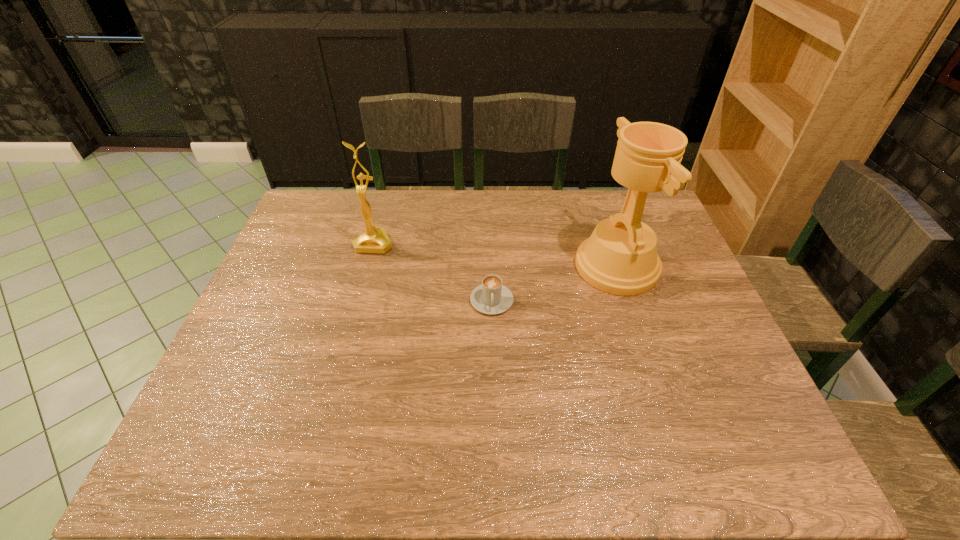
Find the location of `the rightmost object`. the rightmost object is located at coordinates (620, 257).

Identify the location of the tallest object. The height and width of the screenshot is (540, 960). (620, 257).

Find the location of a particular element. The width and height of the screenshot is (960, 540). the left award is located at coordinates (374, 239).

Locate an element on the screen. This screenshot has width=960, height=540. the second tallest object is located at coordinates (374, 239).

Locate an element on the screen. The width and height of the screenshot is (960, 540). cappuccino is located at coordinates (491, 297).

Locate an element on the screen. the second object from right to left is located at coordinates coord(491,297).

The height and width of the screenshot is (540, 960). What are the coordinates of `vacant space situated on the front of the rightmost object` in the screenshot? It's located at (671, 433).

You are a GUI agent. You are given a task and a screenshot of the screen. Output one action in this format:
    pyautogui.click(x=<x>, y=<y>)
    Task: Click on the vacant space located on the front-facing side of the left award
    This screenshot has height=540, width=960.
    Given the screenshot: What is the action you would take?
    pyautogui.click(x=353, y=320)

This screenshot has width=960, height=540. Find the location of `blank space located 0.090m to the right of the cappuccino`. blank space located 0.090m to the right of the cappuccino is located at coordinates (492, 345).

Where is `object positioned at the far edge`? This screenshot has height=540, width=960. object positioned at the far edge is located at coordinates (374, 239).